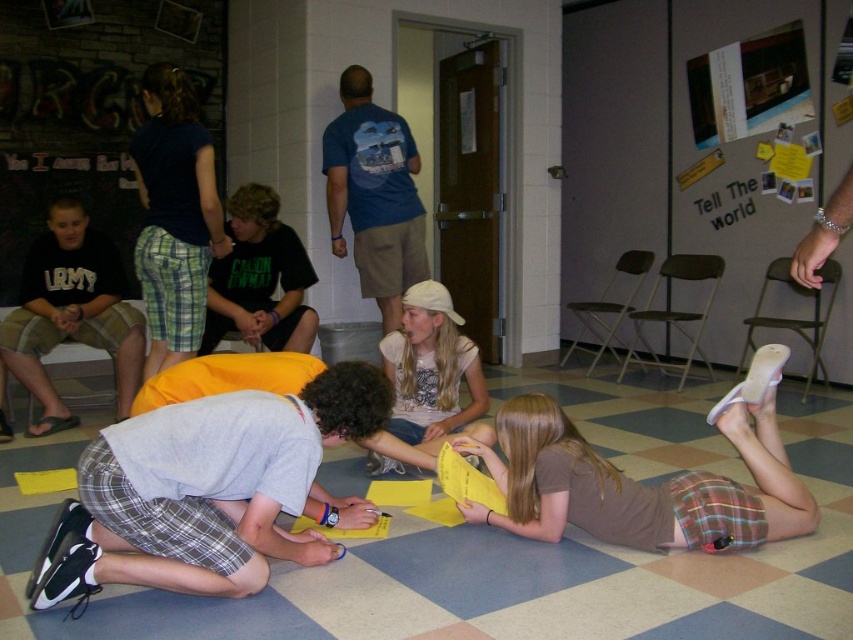
Question: Is army green shorts at left to the left of white cotton shirt at center from the viewer's perspective?

Choices:
 (A) no
 (B) yes

Answer: (B)

Question: Is army green shorts at left above white cotton shirt at center?

Choices:
 (A) no
 (B) yes

Answer: (B)

Question: Which point is closer to the camera?

Choices:
 (A) (4, 337)
 (B) (466, 369)

Answer: (B)

Question: Which of the following is the farthest from the observer?

Choices:
 (A) army green shorts at left
 (B) white cotton shirt at center

Answer: (A)

Question: Which object appears farthest from the camera in this image?

Choices:
 (A) white cotton shirt at center
 (B) army green shorts at left

Answer: (B)

Question: Observing the image, what is the correct spatial positioning of army green shorts at left in reference to white cotton shirt at center?

Choices:
 (A) right
 (B) left

Answer: (B)